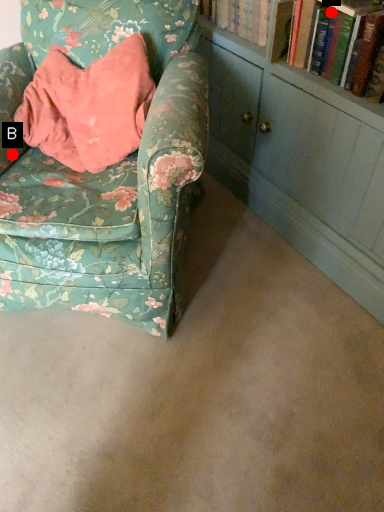
Question: Two points are circled on the image, labeled by A and B beside each circle. Which point appears farthest from the camera in this image?

Choices:
 (A) A is further
 (B) B is further

Answer: (B)